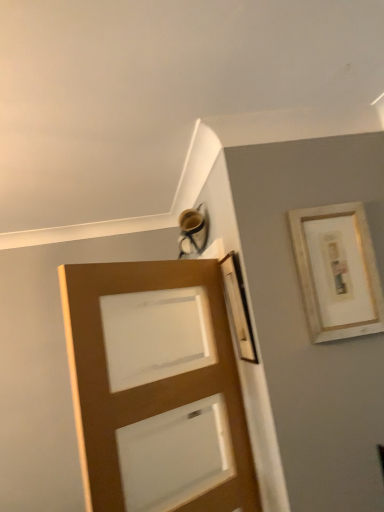
I want to click on brown matte door at center, so click(156, 388).

What do you see at coordinates (156, 388) in the screenshot? I see `brown matte door at center` at bounding box center [156, 388].

Locate an element on the screen. Image resolution: width=384 pixels, height=512 pixels. gold-framed artwork at upper right is located at coordinates (337, 271).

What do you see at coordinates (337, 271) in the screenshot?
I see `gold-framed artwork at upper right` at bounding box center [337, 271].

Find the location of `brown matte door at center`. brown matte door at center is located at coordinates (156, 388).

Considering the relative positions of gold-framed artwork at upper right and brown matte door at center in the image provided, is gold-framed artwork at upper right to the left or to the right of brown matte door at center?

gold-framed artwork at upper right is positioned on brown matte door at center's right side.

In the scene shown: Does gold-framed artwork at upper right come behind brown matte door at center?

Yes, gold-framed artwork at upper right is further from the camera.

Considering the positions of point (355, 219) and point (75, 368), is point (355, 219) closer or farther from the camera than point (75, 368)?

Point (355, 219) appears to be farther away from the viewer than point (75, 368).

From the image's perspective, who appears lower, gold-framed artwork at upper right or brown matte door at center?

brown matte door at center, from the image's perspective.

From a real-world perspective, relative to brown matte door at center, is gold-framed artwork at upper right vertically above or below?

Clearly, from a real-world perspective, gold-framed artwork at upper right is above brown matte door at center.

Can you confirm if gold-framed artwork at upper right is thinner than brown matte door at center?

Yes.

From the picture: In terms of height, does gold-framed artwork at upper right look taller or shorter compared to brown matte door at center?

In the image, gold-framed artwork at upper right appears to be shorter than brown matte door at center.

Can you confirm if gold-framed artwork at upper right is smaller than brown matte door at center?

Indeed, gold-framed artwork at upper right has a smaller size compared to brown matte door at center.

Is gold-framed artwork at upper right inside the boundaries of brown matte door at center, or outside?

gold-framed artwork at upper right is outside brown matte door at center.

Is gold-framed artwork at upper right far from brown matte door at center?

No, gold-framed artwork at upper right is in close proximity to brown matte door at center.

Does gold-framed artwork at upper right turn towards brown matte door at center?

No, gold-framed artwork at upper right does not turn towards brown matte door at center.

In the scene shown: What's the angular difference between gold-framed artwork at upper right and brown matte door at center's facing directions?

The facing directions of gold-framed artwork at upper right and brown matte door at center are 145 degrees apart.

This screenshot has height=512, width=384. What are the coordinates of `door below the gold-framed artwork at upper right (from the image's perspective)` in the screenshot? It's located at (156, 388).

Does brown matte door at center appear on the right side of gold-framed artwork at upper right?

No.

Does brown matte door at center come in front of gold-framed artwork at upper right?

That is True.

Between point (144, 460) and point (361, 223), which one is positioned in front?

The point (144, 460) is closer to the camera.

From the image's perspective, would you say brown matte door at center is positioned over gold-framed artwork at upper right?

No, from the image's perspective, brown matte door at center is not over gold-framed artwork at upper right.

From a real-world perspective, is brown matte door at center over gold-framed artwork at upper right?

No.

Considering the relative sizes of brown matte door at center and gold-framed artwork at upper right in the image provided, is brown matte door at center wider than gold-framed artwork at upper right?

Yes.

Considering the relative sizes of brown matte door at center and gold-framed artwork at upper right in the image provided, is brown matte door at center shorter than gold-framed artwork at upper right?

No.

Consider the image. Which of these two, brown matte door at center or gold-framed artwork at upper right, is bigger?

With larger size is brown matte door at center.

Is brown matte door at center completely or partially outside of gold-framed artwork at upper right?

That's correct, brown matte door at center is outside of gold-framed artwork at upper right.

Are brown matte door at center and gold-framed artwork at upper right far apart?

They are positioned close to each other.

Is brown matte door at center oriented away from gold-framed artwork at upper right?

Yes, brown matte door at center is positioned with its back facing gold-framed artwork at upper right.

Can you tell me how much brown matte door at center and gold-framed artwork at upper right differ in facing direction?

The angle between the facing direction of brown matte door at center and the facing direction of gold-framed artwork at upper right is 145 degrees.

This screenshot has width=384, height=512. Identify the location of door on the left of the gold-framed artwork at upper right. (156, 388).

The width and height of the screenshot is (384, 512). I want to click on picture frame lying on the right of brown matte door at center, so click(x=337, y=271).

This screenshot has width=384, height=512. Find the location of `picture frame above the brown matte door at center (from the image's perspective)`. picture frame above the brown matte door at center (from the image's perspective) is located at coordinates (337, 271).